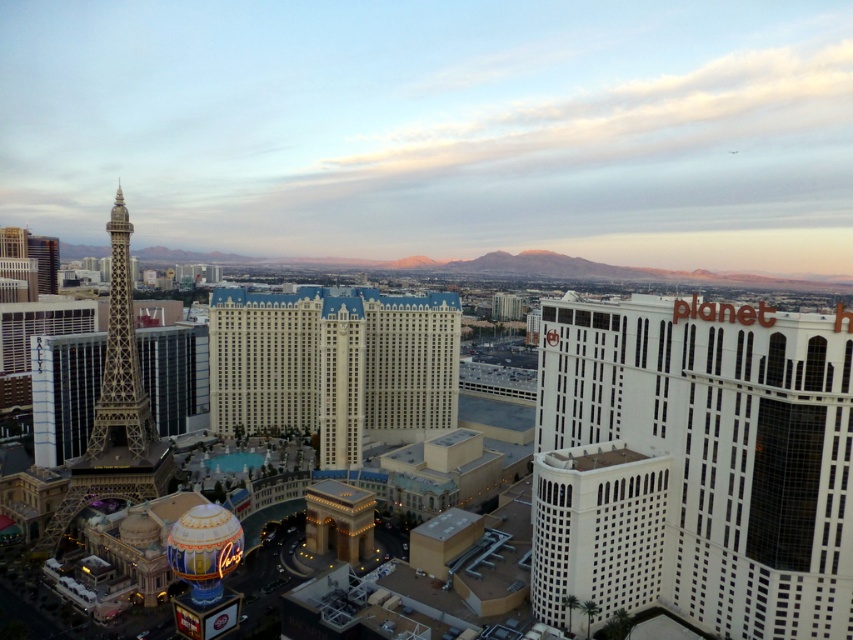
Does white glass building at right appear over gold metallic eiffel tower at left?

No.

Is point (712, 458) farther from viewer compared to point (111, 496)?

No, it is in front of (111, 496).

Where is `white glass building at right`? This screenshot has width=853, height=640. white glass building at right is located at coordinates (694, 465).

Which is behind, point (392, 387) or point (96, 419)?

Positioned behind is point (392, 387).

Does point (439, 413) come closer to viewer compared to point (122, 268)?

No, it is not.

The width and height of the screenshot is (853, 640). I want to click on white textured building at center, so click(x=334, y=365).

Is point (4, 26) farther from viewer compared to point (560, 481)?

Yes, it is behind point (560, 481).

Between point (432, 204) and point (663, 480), which one is positioned in front?

Point (663, 480) is more forward.

Between point (397, 250) and point (659, 358), which one is positioned behind?

Point (397, 250)

Locate an element on the screen. matte glass tower at left is located at coordinates (438, 129).